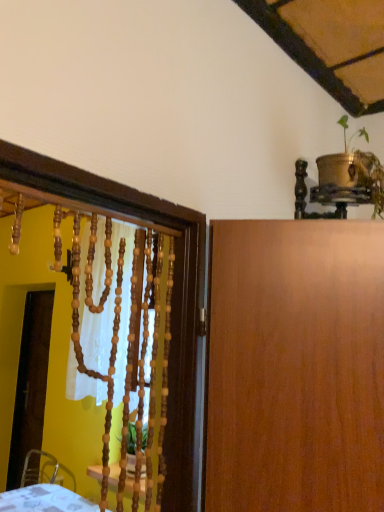
At what (x,y) coordinates should I click in order to perform the action: click on brown wooden screen door at left. Please return your answer as a coordinate pair (x, y). Looking at the image, I should click on (30, 382).

Measure the distance between point (37,447) and camera.

Point (37,447) and camera are 3.70 meters apart.

What do you see at coordinates (30, 382) in the screenshot? The image size is (384, 512). I see `brown wooden screen door at left` at bounding box center [30, 382].

The image size is (384, 512). Identify the location of brown wooden screen door at left. coord(30,382).